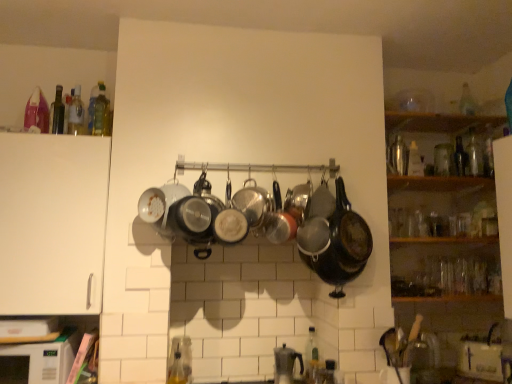
The image size is (512, 384). Describe the element at coordinates (57, 113) in the screenshot. I see `green glass bottle at upper left, positioned as the 7th bottle in back-to-front order` at that location.

The height and width of the screenshot is (384, 512). I want to click on white matte cabinet at left, so click(x=52, y=223).

At what (x,y) coordinates should I click in order to perform the action: click on translucent glass bottle at upper left, the 4th bottle when ordered from front to back. Please return your answer as a coordinate pair (x, y). The width and height of the screenshot is (512, 384). Looking at the image, I should click on (76, 112).

Where is `white matte microwave at lower left`? white matte microwave at lower left is located at coordinates (47, 358).

I want to click on bottle that is the 4th object located above the transparent plastic bottle at center, which ranks as the 6th bottle in front-to-back order (from the image's perspective), so 101,113.

Can you confirm if transparent plastic bottle at center, which is the 4th bottle in right-to-left order, is thinner than translucent glass bottle at upper left, which appears as the eighth bottle when viewed from the back?

Correct, the width of transparent plastic bottle at center, which is the 4th bottle in right-to-left order, is less than that of translucent glass bottle at upper left, which appears as the eighth bottle when viewed from the back.

From the image's perspective, is transparent plastic bottle at center, the 6th bottle from the left, over translucent glass bottle at upper left, which is counted as the 2th bottle, starting from the front?

No, from the image's perspective, transparent plastic bottle at center, the 6th bottle from the left, is not above translucent glass bottle at upper left, which is counted as the 2th bottle, starting from the front.

Is transparent glass bottle at upper right, which is the 1th bottle in back-to-front order, wider than transparent glass bottle at upper right, the 7th bottle in the left-to-right sequence?

Incorrect, the width of transparent glass bottle at upper right, which is the 1th bottle in back-to-front order, does not surpass that of transparent glass bottle at upper right, the 7th bottle in the left-to-right sequence.

Does transparent glass bottle at upper right, the 9th bottle positioned from the left, have a smaller size compared to transparent glass bottle at upper right, which is the seventh bottle from front to back?

No, transparent glass bottle at upper right, the 9th bottle positioned from the left, is not smaller than transparent glass bottle at upper right, which is the seventh bottle from front to back.

Which is more to the left, transparent glass bottle at upper right, the 9th bottle positioned from the left, or transparent glass bottle at upper right, the third bottle positioned from the right?

From the viewer's perspective, transparent glass bottle at upper right, the third bottle positioned from the right, appears more on the left side.

From the picture: From the image's perspective, between green glass bottle at upper left, the ninth bottle in the right-to-left sequence, and translucent glass bottle at upper left, the fifth bottle when ordered from front to back, who is located below?

green glass bottle at upper left, the ninth bottle in the right-to-left sequence.

From their relative heights in the image, would you say green glass bottle at upper left, positioned as the 7th bottle in back-to-front order, is taller or shorter than translucent glass bottle at upper left, which appears as the 7th bottle when viewed from the right?

Clearly, green glass bottle at upper left, positioned as the 7th bottle in back-to-front order, is shorter compared to translucent glass bottle at upper left, which appears as the 7th bottle when viewed from the right.

Does green glass bottle at upper left, the 3th bottle positioned from the front, appear on the right side of translucent glass bottle at upper left, which appears as the 7th bottle when viewed from the right?

In fact, green glass bottle at upper left, the 3th bottle positioned from the front, is to the left of translucent glass bottle at upper left, which appears as the 7th bottle when viewed from the right.

You are a GUI agent. You are given a task and a screenshot of the screen. Output one action in this format:
    pyautogui.click(x=<x>, y=<y>)
    Task: Click on the 2nd bottle positioned above the green glass bottle at upper left, the ninth bottle in the right-to-left sequence (from a real-world perspective)
    This screenshot has width=512, height=384.
    Given the screenshot: What is the action you would take?
    pyautogui.click(x=94, y=104)

Does shiny black wok at center have a lesser width compared to transparent glass bottle at upper right, the third bottle positioned from the right?

In fact, shiny black wok at center might be wider than transparent glass bottle at upper right, the third bottle positioned from the right.

From the image's perspective, is shiny black wok at center over transparent glass bottle at upper right, acting as the 3th bottle starting from the back?

No, from the image's perspective, shiny black wok at center is not over transparent glass bottle at upper right, acting as the 3th bottle starting from the back.

Which is correct: shiny black wok at center is inside transparent glass bottle at upper right, acting as the 3th bottle starting from the back, or outside of it?

shiny black wok at center is spatially situated outside transparent glass bottle at upper right, acting as the 3th bottle starting from the back.

Is transparent glass bottle at upper right, which is the seventh bottle from front to back, facing towards translucent glass bottle at lower center, acting as the 9th bottle starting from the back?

No, transparent glass bottle at upper right, which is the seventh bottle from front to back, is not turned towards translucent glass bottle at lower center, acting as the 9th bottle starting from the back.

From the image's perspective, starting from the translucent glass bottle at lower center, which ranks as the first bottle in front-to-back order, which bottle is the 1st one above? Please provide its 2D coordinates.

[(460, 157)]

From the image's perspective, which is below, transparent glass bottle at upper right, acting as the 3th bottle starting from the back, or translucent glass bottle at lower center, acting as the 9th bottle starting from the back?

translucent glass bottle at lower center, acting as the 9th bottle starting from the back, from the image's perspective.

Can you tell me how much transparent glass bottle at upper right, placed as the second bottle when sorted from back to front, and transparent glass bottle at upper right, the third bottle positioned from the right, differ in facing direction?

The angle between the facing direction of transparent glass bottle at upper right, placed as the second bottle when sorted from back to front, and the facing direction of transparent glass bottle at upper right, the third bottle positioned from the right, is 0.00288 degrees.

From their relative heights in the image, would you say transparent glass bottle at upper right, which appears as the 8th bottle when viewed from the left, is taller or shorter than transparent glass bottle at upper right, acting as the 3th bottle starting from the back?

Considering their sizes, transparent glass bottle at upper right, which appears as the 8th bottle when viewed from the left, has more height than transparent glass bottle at upper right, acting as the 3th bottle starting from the back.

Does transparent glass bottle at upper right, marked as the 2th bottle in a right-to-left arrangement, contain transparent glass bottle at upper right, the 7th bottle in the left-to-right sequence?

No, transparent glass bottle at upper right, the 7th bottle in the left-to-right sequence, is located outside of transparent glass bottle at upper right, marked as the 2th bottle in a right-to-left arrangement.

Is transparent glass bottle at upper right, which is the 1th bottle in back-to-front order, wider than translucent glass bottle at upper left, the eighth bottle from the right?

Yes.

Is there a large distance between transparent glass bottle at upper right, arranged as the 1th bottle when viewed from the right, and translucent glass bottle at upper left, the 4th bottle when ordered from front to back?

Yes.

Relative to translucent glass bottle at upper left, the 6th bottle positioned from the back, is transparent glass bottle at upper right, which is the 1th bottle in back-to-front order, in front or behind?

transparent glass bottle at upper right, which is the 1th bottle in back-to-front order, is behind translucent glass bottle at upper left, the 6th bottle positioned from the back.

At what (x,y) coordinates should I click in order to perform the action: click on the 2nd bottle counting from the right of the translucent glass bottle at upper left, arranged as the fourth bottle when viewed from the left. Please return your answer as a coordinate pair (x, y). Image resolution: width=512 pixels, height=384 pixels. Looking at the image, I should click on (311, 355).

Where is `bottle that is the 6th one above the transparent glass bottle at upper right, which is the seventh bottle from front to back (from a real-world perspective)`? The width and height of the screenshot is (512, 384). bottle that is the 6th one above the transparent glass bottle at upper right, which is the seventh bottle from front to back (from a real-world perspective) is located at coordinates pyautogui.click(x=467, y=102).

Looking at the image, which one is located further to translucent glass bottle at upper left, placed as the fifth bottle when sorted from back to front, green glass bottle at upper left, the 3th bottle positioned from the front, or translucent glass bottle at upper left, the 6th bottle positioned from the back?

Based on the image, green glass bottle at upper left, the 3th bottle positioned from the front, appears to be further to translucent glass bottle at upper left, placed as the fifth bottle when sorted from back to front.

Based on their spatial positions, is translucent glass bottle at upper left, arranged as the fourth bottle when viewed from the left, or white matte microwave at lower left closer to transparent glass bottle at upper right, the 9th bottle positioned from the left?

The object closer to transparent glass bottle at upper right, the 9th bottle positioned from the left, is translucent glass bottle at upper left, arranged as the fourth bottle when viewed from the left.

When comparing their distances from transparent glass bottle at upper right, which is the 1th bottle in back-to-front order, does translucent glass bottle at lower center, acting as the 9th bottle starting from the back, or transparent plastic bottle at center, the 6th bottle from the left, seem closer?

The object closer to transparent glass bottle at upper right, which is the 1th bottle in back-to-front order, is transparent plastic bottle at center, the 6th bottle from the left.

Estimate the real-world distances between objects in this image. Which object is closer to transparent plastic bottle at center, which is the 4th bottle in right-to-left order, green glass bottle at upper left, positioned as the 7th bottle in back-to-front order, or shiny black wok at center?

shiny black wok at center.

When comparing their distances from transparent glass bottle at upper right, marked as the 2th bottle in a right-to-left arrangement, does white matte microwave at lower left or transparent plastic bottle at center, the 6th bottle from the left, seem closer?

transparent plastic bottle at center, the 6th bottle from the left, is positioned closer to the anchor transparent glass bottle at upper right, marked as the 2th bottle in a right-to-left arrangement.

Based on their spatial positions, is white matte cabinet at left or transparent plastic bottle at center, which ranks as the 6th bottle in front-to-back order, closer to satin silver coffee maker at lower center?

transparent plastic bottle at center, which ranks as the 6th bottle in front-to-back order.

When comparing their distances from translucent glass bottle at upper left, the fifth bottle when ordered from front to back, does transparent glass bottle at upper right, which is the 1th bottle in back-to-front order, or translucent glass bottle at upper left, the eighth bottle from the right, seem further?

transparent glass bottle at upper right, which is the 1th bottle in back-to-front order, lies further to translucent glass bottle at upper left, the fifth bottle when ordered from front to back, than the other object.

Considering their positions, is transparent glass bottle at upper right, the third bottle positioned from the right, positioned closer to green glass bottle at upper left, marked as the 1th bottle in a left-to-right arrangement, than white matte microwave at lower left?

white matte microwave at lower left is closer to green glass bottle at upper left, marked as the 1th bottle in a left-to-right arrangement.

The height and width of the screenshot is (384, 512). I want to click on microwave between translucent glass bottle at upper left, which appears as the 7th bottle when viewed from the right, and translucent glass bottle at lower center, which ranks as the first bottle in front-to-back order, from top to bottom, so click(47, 358).

The width and height of the screenshot is (512, 384). I want to click on wok between white matte microwave at lower left and transparent glass bottle at upper right, the third bottle positioned from the right, in the horizontal direction, so click(349, 233).

At what (x,y) coordinates should I click in order to perform the action: click on wok between white matte microwave at lower left and transparent glass bottle at upper right, the 9th bottle positioned from the left, from left to right. Please return your answer as a coordinate pair (x, y). Looking at the image, I should click on (349, 233).

Image resolution: width=512 pixels, height=384 pixels. I want to click on wok between satin silver coffee maker at lower center and transparent glass bottle at upper right, which appears as the 8th bottle when viewed from the left, from left to right, so click(349, 233).